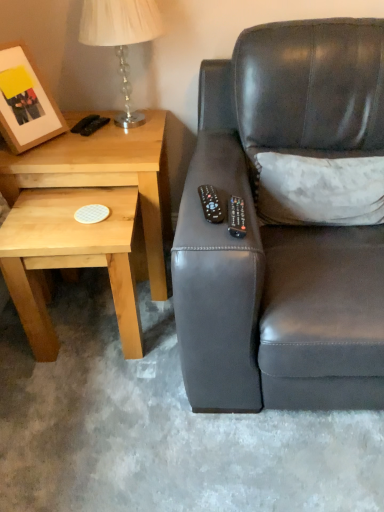
The height and width of the screenshot is (512, 384). I want to click on free space in front of translucent glass table lamp at upper left, so click(x=104, y=154).